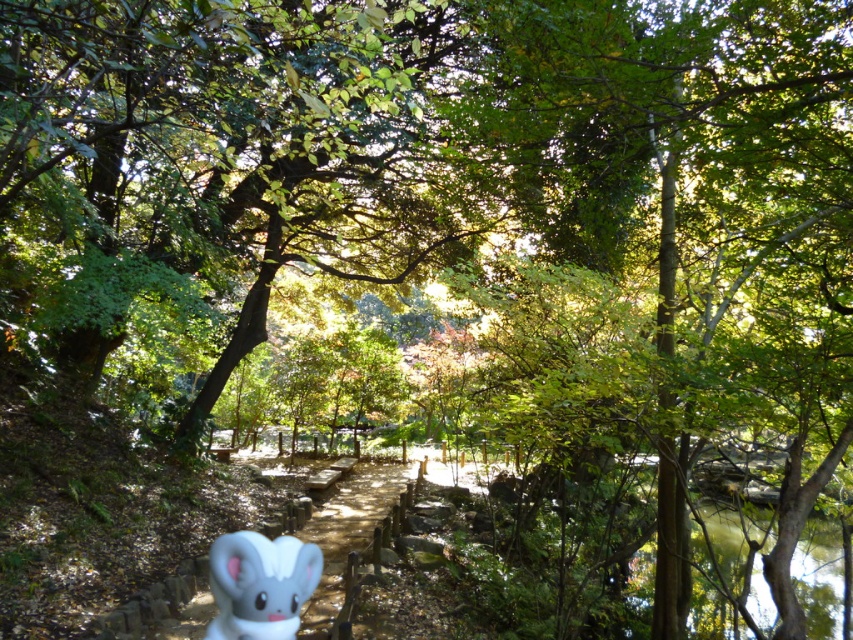
Question: Can you confirm if wooden at center is thinner than white matte bunny at lower center?

Choices:
 (A) yes
 (B) no

Answer: (B)

Question: Which object is farther from the camera taking this photo?

Choices:
 (A) white matte bunny at lower center
 (B) wooden at center

Answer: (B)

Question: Does wooden at center come in front of white matte bunny at lower center?

Choices:
 (A) no
 (B) yes

Answer: (A)

Question: Among these points, which one is nearest to the camera?

Choices:
 (A) (271, 582)
 (B) (347, 493)

Answer: (A)

Question: Which of the following is the closest to the observer?

Choices:
 (A) wooden at center
 (B) white matte bunny at lower center

Answer: (B)

Question: In this image, where is wooden at center located relative to white matte bunny at lower center?

Choices:
 (A) below
 (B) above

Answer: (A)